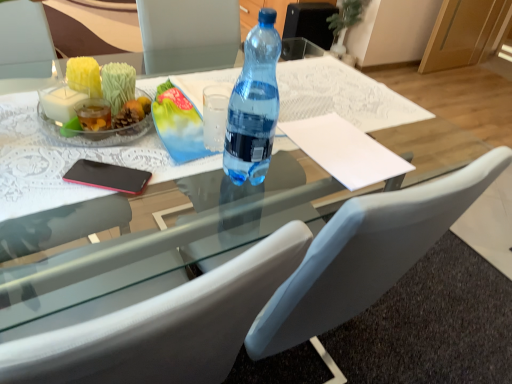
Locate an element on the screen. The width and height of the screenshot is (512, 384). vacant point above white paper at center (from a real-world perspective) is located at coordinates (345, 143).